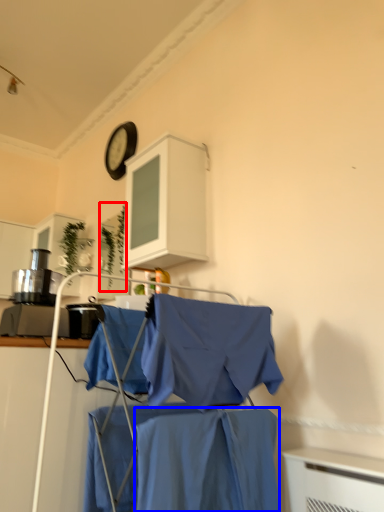
Question: Which object is closer to the camera taking this photo, plant (highlighted by a red box) or fabric (highlighted by a blue box)?

Choices:
 (A) plant
 (B) fabric

Answer: (B)